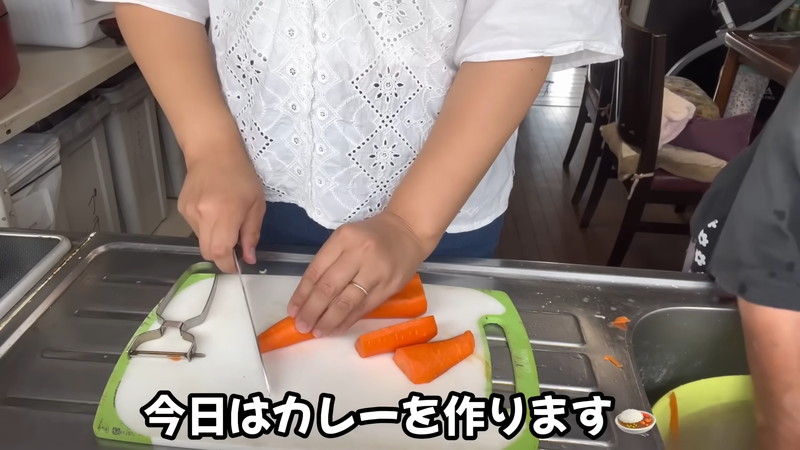
Identify the location of chair. (638, 97), (600, 80).